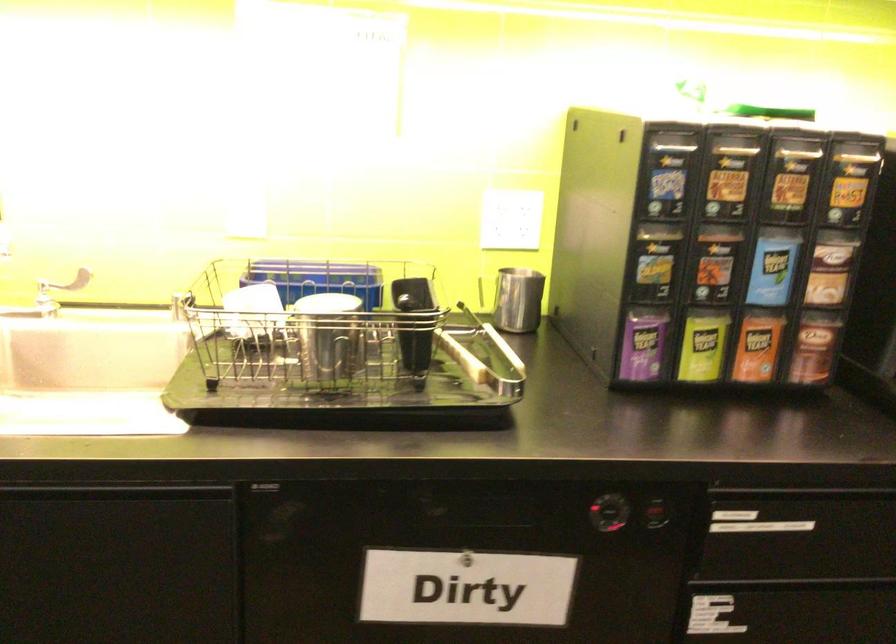
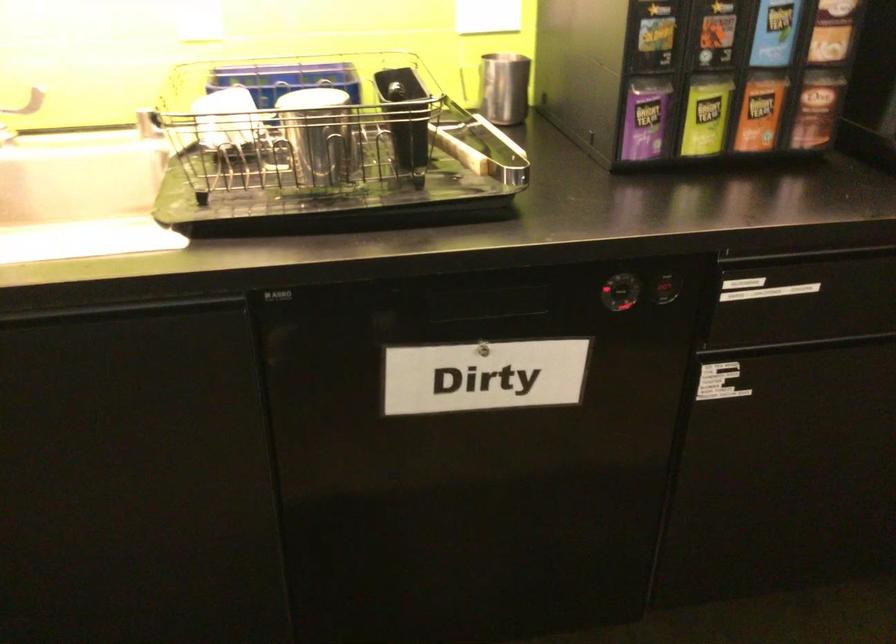
The point at [702,345] is marked in the first image. Where is the corresponding point in the second image?

(705, 116)